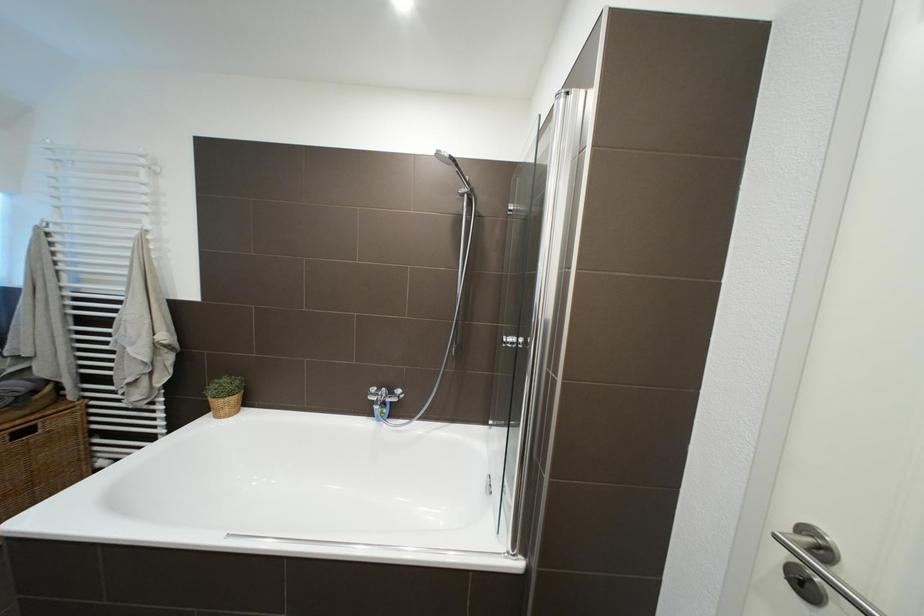
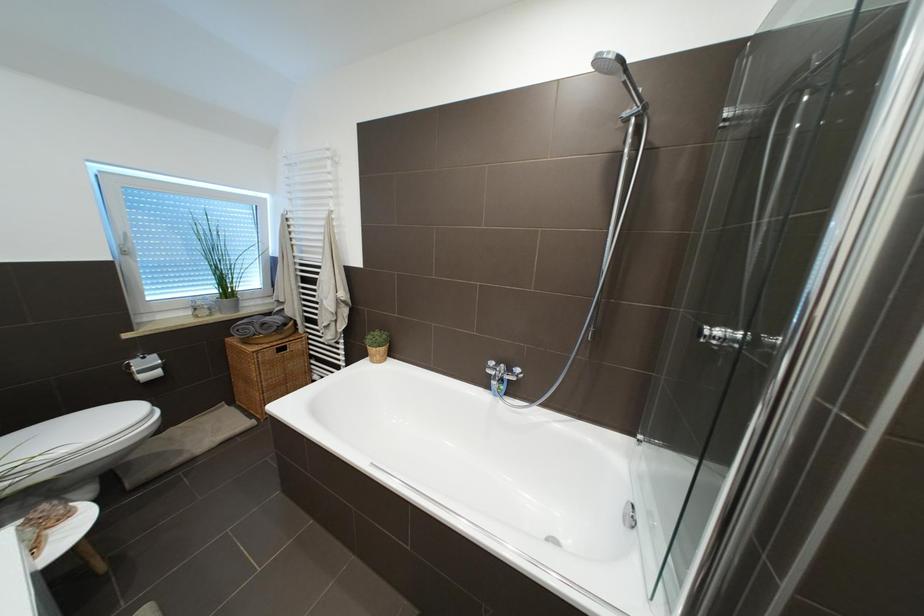
Which direction would the cameraman need to move to produce the second image?

The movement direction of the cameraman is left, forward.